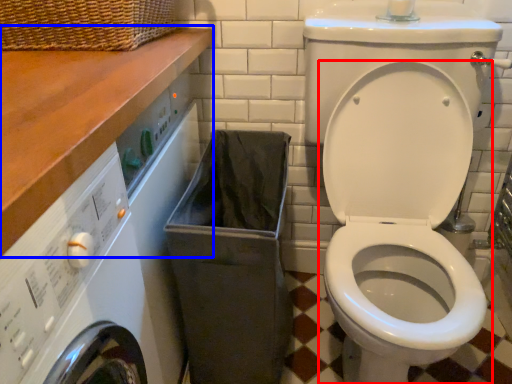
Question: Which object appears closest to the camera in this image, toilet (highlighted by a red box) or counter top (highlighted by a blue box)?

Choices:
 (A) toilet
 (B) counter top

Answer: (B)